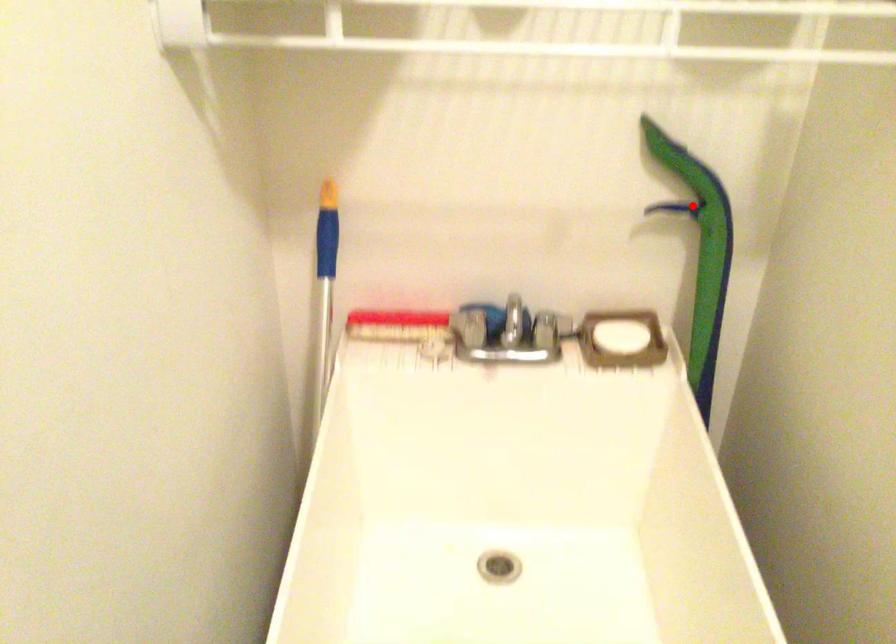
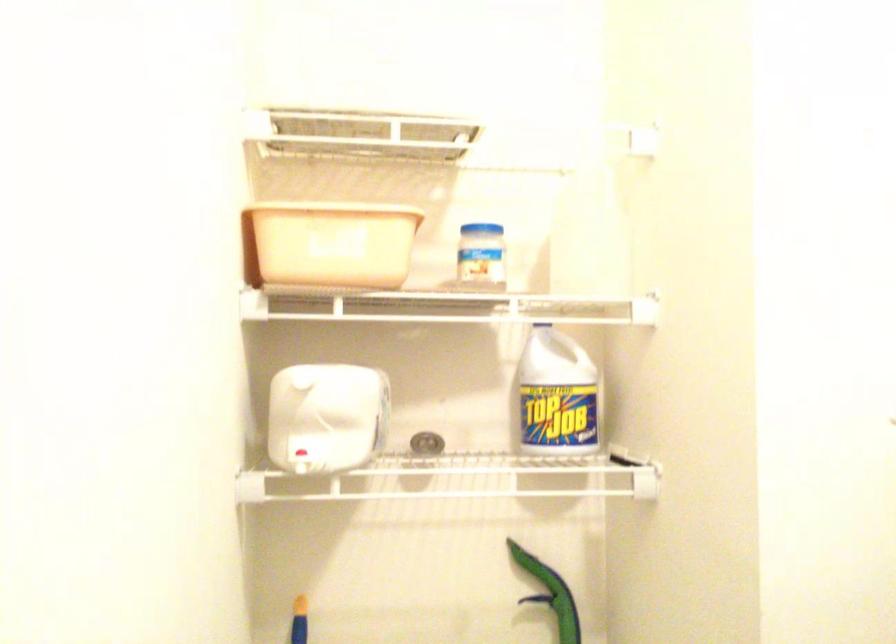
Question: I am providing you with two images of the same scene from different viewpoints. In image1, a red point is highlighted. Considering the same 3D point in image2, which of the following is correct?

Choices:
 (A) It is closer
 (B) It is farther

Answer: (B)